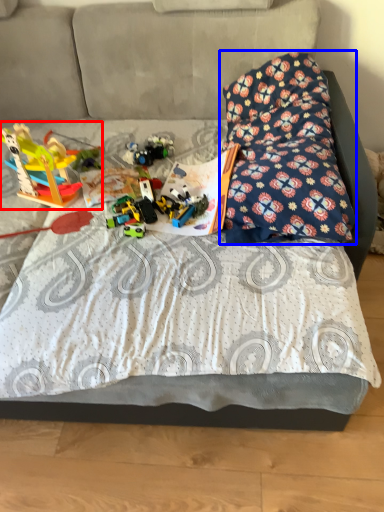
Question: Which object appears farthest to the camera in this image, toy (highlighted by a red box) or pillow (highlighted by a blue box)?

Choices:
 (A) toy
 (B) pillow

Answer: (A)